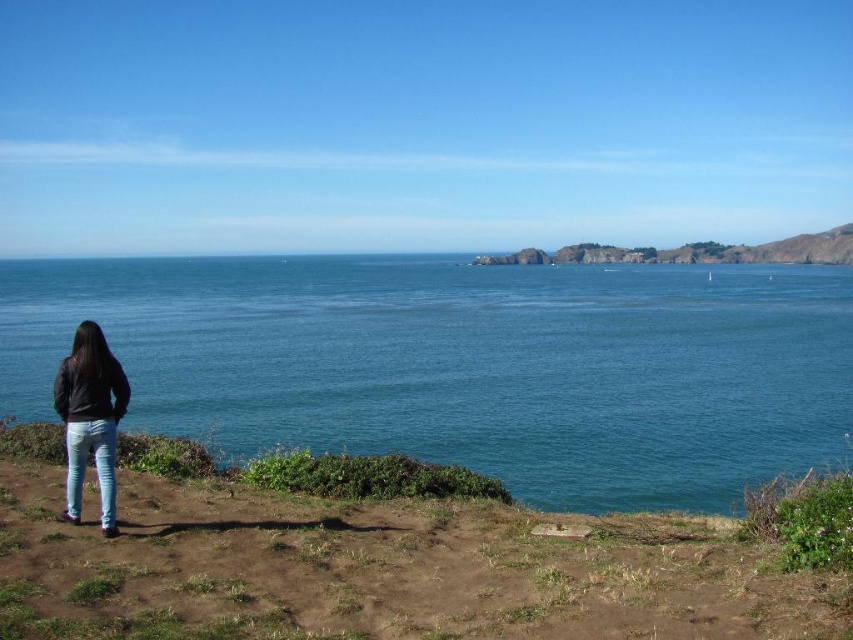
Does point (515, 464) come farther from viewer compared to point (93, 369)?

Yes, point (515, 464) is behind point (93, 369).

Based on the photo, does blue water at center have a lesser height compared to jeans at left?

No.

The image size is (853, 640). Find the location of `blue water at center`. blue water at center is located at coordinates (465, 364).

Is jeans at left below blue denim jeans at lower left?

Actually, jeans at left is above blue denim jeans at lower left.

Between point (117, 401) and point (107, 419), which one is positioned in front?

Point (107, 419) is more forward.

The height and width of the screenshot is (640, 853). I want to click on jeans at left, so click(x=90, y=419).

The image size is (853, 640). Find the location of `jeans at left`. jeans at left is located at coordinates (90, 419).

Consider the image. Is brown dirt at lower left positioned before rugged rock formation at center?

That is True.

Which is in front, point (729, 557) or point (607, 253)?

Positioned in front is point (729, 557).

Locate an element on the screen. This screenshot has height=640, width=853. brown dirt at lower left is located at coordinates (376, 568).